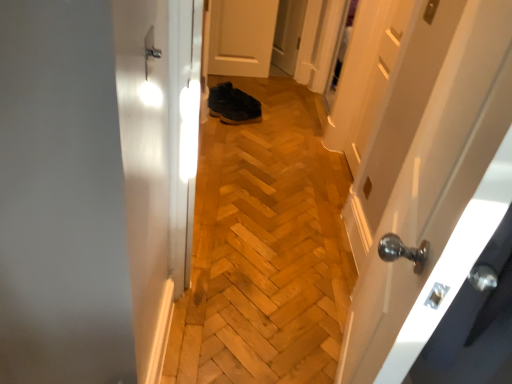
Question: Should I look upward or downward to see white glossy door at right, which is the first door in bottom-to-top order?

Choices:
 (A) down
 (B) up

Answer: (A)

Question: Can you confirm if satin nickel door handle at upper center is positioned to the left of white glossy door at right, the 1th door viewed from the front?

Choices:
 (A) yes
 (B) no

Answer: (A)

Question: Considering the relative positions of satin nickel door handle at upper center and white glossy door at right, the 2th door when ordered from top to bottom, in the image provided, is satin nickel door handle at upper center in front of white glossy door at right, the 2th door when ordered from top to bottom,?

Choices:
 (A) no
 (B) yes

Answer: (A)

Question: Is white glossy door at right, the 1th door viewed from the front, surrounded by satin nickel door handle at upper center?

Choices:
 (A) no
 (B) yes

Answer: (A)

Question: Considering the relative sizes of satin nickel door handle at upper center and white glossy door at right, the 1th door viewed from the front, in the image provided, is satin nickel door handle at upper center thinner than white glossy door at right, the 1th door viewed from the front,?

Choices:
 (A) no
 (B) yes

Answer: (B)

Question: Considering the relative sizes of satin nickel door handle at upper center and white glossy door at right, the 2th door when ordered from top to bottom, in the image provided, is satin nickel door handle at upper center taller than white glossy door at right, the 2th door when ordered from top to bottom,?

Choices:
 (A) no
 (B) yes

Answer: (A)

Question: From the image's perspective, is satin nickel door handle at upper center on top of white glossy door at right, the 1th door viewed from the front?

Choices:
 (A) no
 (B) yes

Answer: (B)

Question: Is white matte door at center, placed as the 1th door when sorted from top to bottom, surrounding dark brown leather shoes at center?

Choices:
 (A) yes
 (B) no

Answer: (B)

Question: Considering the relative positions of white matte door at center, arranged as the second door when viewed from the front, and dark brown leather shoes at center in the image provided, is white matte door at center, arranged as the second door when viewed from the front, in front of dark brown leather shoes at center?

Choices:
 (A) yes
 (B) no

Answer: (B)

Question: Considering the relative positions of white matte door at center, which is counted as the first door, starting from the back, and dark brown leather shoes at center in the image provided, is white matte door at center, which is counted as the first door, starting from the back, to the left of dark brown leather shoes at center from the viewer's perspective?

Choices:
 (A) no
 (B) yes

Answer: (A)

Question: Is white matte door at center, marked as the 2th door in a bottom-to-top arrangement, at the right side of dark brown leather shoes at center?

Choices:
 (A) yes
 (B) no

Answer: (A)

Question: Can you confirm if white matte door at center, placed as the 1th door when sorted from top to bottom, is bigger than dark brown leather shoes at center?

Choices:
 (A) no
 (B) yes

Answer: (B)

Question: Is white matte door at center, arranged as the second door when viewed from the front, far away from dark brown leather shoes at center?

Choices:
 (A) no
 (B) yes

Answer: (A)

Question: Does satin nickel door handle at upper center have a greater height compared to dark brown leather shoes at center?

Choices:
 (A) yes
 (B) no

Answer: (B)